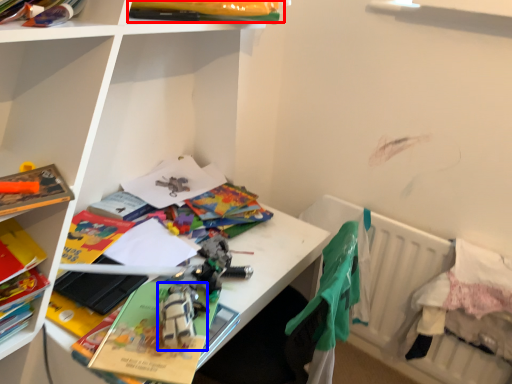
Question: Which object appears closest to the camera in this image, book (highlighted by a red box) or toy (highlighted by a blue box)?

Choices:
 (A) book
 (B) toy

Answer: (B)